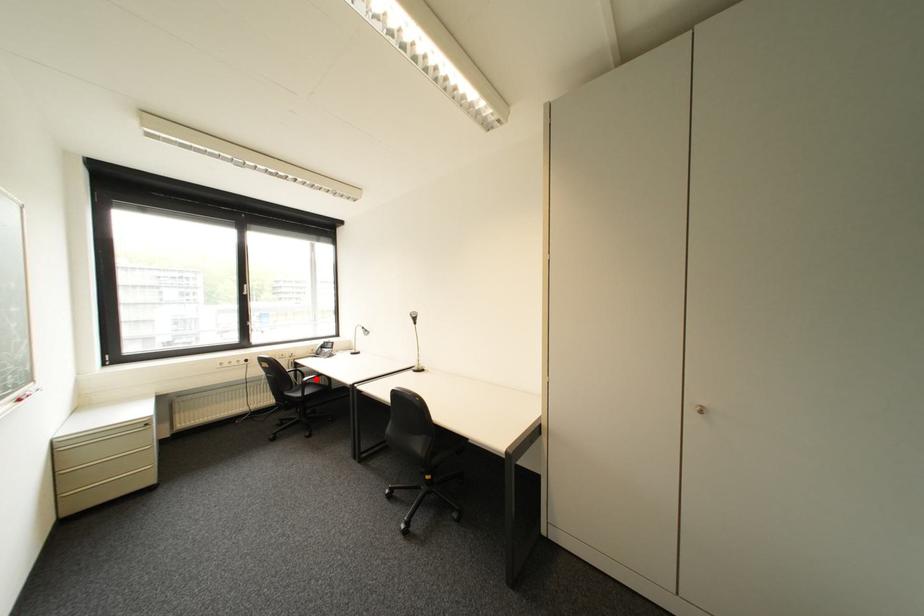
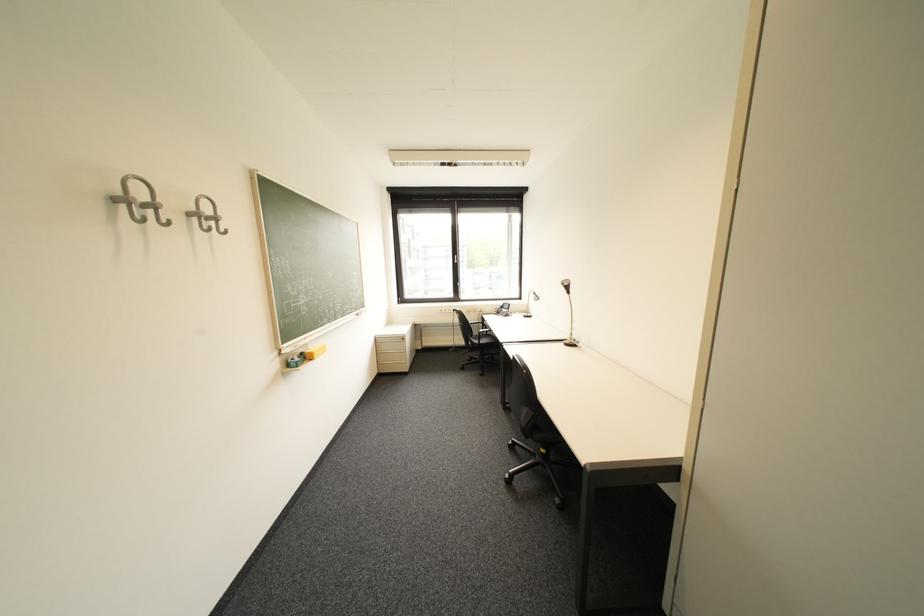
Where in the second image is the point corresponding to the highlighted location from the first image?

(492, 331)